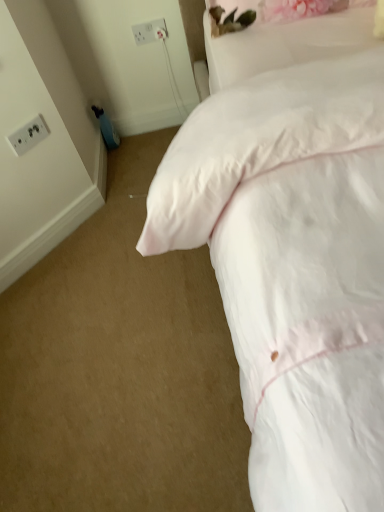
What is the approximate width of white soft bed at upper right?

white soft bed at upper right is 6.16 feet wide.

This screenshot has width=384, height=512. Identify the location of white plastic socket at upper left, the 2th electric outlet when ordered from bottom to top. (150, 31).

Is point (31, 140) positioned in front of point (370, 253)?

No, (31, 140) is behind (370, 253).

From the picture: What's the angular difference between white plastic electrical outlet at upper left, arranged as the first electric outlet when ordered from the bottom, and white soft bed at upper right's facing directions?

43.3 degrees.

In the scene shown: Considering the relative positions of white plastic electrical outlet at upper left, placed as the 2th electric outlet when sorted from right to left, and white soft bed at upper right in the image provided, is white plastic electrical outlet at upper left, placed as the 2th electric outlet when sorted from right to left, to the left or to the right of white soft bed at upper right?

From the image, it's evident that white plastic electrical outlet at upper left, placed as the 2th electric outlet when sorted from right to left, is to the left of white soft bed at upper right.

Is white plastic electrical outlet at upper left, the 2th electric outlet in the back-to-front sequence, far from white soft bed at upper right?

They are positioned close to each other.

Can we say white soft bed at upper right lies outside white plastic socket at upper left, placed as the first electric outlet when sorted from back to front?

white soft bed at upper right lies outside white plastic socket at upper left, placed as the first electric outlet when sorted from back to front,'s area.

From a real-world perspective, is white soft bed at upper right over white plastic socket at upper left, the first electric outlet positioned from the right?

Indeed, from a real-world perspective, white soft bed at upper right stands above white plastic socket at upper left, the first electric outlet positioned from the right.

Does white soft bed at upper right touch white plastic socket at upper left, positioned as the first electric outlet in top-to-bottom order?

white soft bed at upper right is not next to white plastic socket at upper left, positioned as the first electric outlet in top-to-bottom order, and they're not touching.

From their relative heights in the image, would you say white soft bed at upper right is taller or shorter than white satin pillow at upper right?

Considering their sizes, white soft bed at upper right has more height than white satin pillow at upper right.

From a real-world perspective, is white soft bed at upper right positioned over white satin pillow at upper right based on gravity?

Actually, white soft bed at upper right is physically below white satin pillow at upper right in the real world.

From the image's perspective, is white soft bed at upper right under white satin pillow at upper right?

Yes.

Looking at this image, is white soft bed at upper right closer to camera compared to white satin pillow at upper right?

Yes, it is in front of white satin pillow at upper right.

From the image's perspective, who appears lower, white plastic socket at upper left, arranged as the 2th electric outlet when viewed from the front, or white plastic electrical outlet at upper left, the 2th electric outlet in the back-to-front sequence?

From the image's view, white plastic electrical outlet at upper left, the 2th electric outlet in the back-to-front sequence, is below.

Does point (141, 40) come closer to viewer compared to point (20, 142)?

No.

Can you confirm if white plastic socket at upper left, placed as the first electric outlet when sorted from back to front, is shorter than white plastic electrical outlet at upper left, arranged as the first electric outlet when ordered from the bottom?

In fact, white plastic socket at upper left, placed as the first electric outlet when sorted from back to front, may be taller than white plastic electrical outlet at upper left, arranged as the first electric outlet when ordered from the bottom.

Is white plastic socket at upper left, the first electric outlet positioned from the right, in front of or behind white satin pillow at upper right in the image?

Clearly, white plastic socket at upper left, the first electric outlet positioned from the right, is behind white satin pillow at upper right.

Is white plastic socket at upper left, which is counted as the 2th electric outlet, starting from the left, positioned beyond the bounds of white satin pillow at upper right?

Yes, white plastic socket at upper left, which is counted as the 2th electric outlet, starting from the left, is located beyond the bounds of white satin pillow at upper right.

Between white plastic socket at upper left, positioned as the first electric outlet in top-to-bottom order, and white satin pillow at upper right, which one has larger size?

Bigger between the two is white satin pillow at upper right.

From a real-world perspective, between white plastic socket at upper left, placed as the first electric outlet when sorted from back to front, and white soft bed at upper right, who is vertically lower?

white plastic socket at upper left, placed as the first electric outlet when sorted from back to front.

From the image's perspective, does white plastic socket at upper left, positioned as the first electric outlet in top-to-bottom order, appear lower than white soft bed at upper right?

No, from the image's perspective, white plastic socket at upper left, positioned as the first electric outlet in top-to-bottom order, is not beneath white soft bed at upper right.

Considering the points (142, 30) and (297, 405), which point is behind, point (142, 30) or point (297, 405)?

The point (142, 30) is farther.

Could white soft bed at upper right be considered to be inside white plastic socket at upper left, which is counted as the 2th electric outlet, starting from the left?

No, white soft bed at upper right is not a part of white plastic socket at upper left, which is counted as the 2th electric outlet, starting from the left.

From the image's perspective, does white plastic electrical outlet at upper left, arranged as the first electric outlet when viewed from the left, appear lower than white plastic socket at upper left, the first electric outlet positioned from the right?

Yes.

From a real-world perspective, is white plastic electrical outlet at upper left, placed as the 2th electric outlet when sorted from right to left, positioned above or below white plastic socket at upper left, which is counted as the 2th electric outlet, starting from the left?

white plastic electrical outlet at upper left, placed as the 2th electric outlet when sorted from right to left, is below white plastic socket at upper left, which is counted as the 2th electric outlet, starting from the left.

You are a GUI agent. You are given a task and a screenshot of the screen. Output one action in this format:
    pyautogui.click(x=<x>, y=<y>)
    Task: Click on the electric outlet on the right of white plastic electrical outlet at upper left, arranged as the first electric outlet when viewed from the left
    The height and width of the screenshot is (512, 384).
    Given the screenshot: What is the action you would take?
    pyautogui.click(x=150, y=31)

Considering the relative sizes of white plastic electrical outlet at upper left, placed as the 2th electric outlet when sorted from right to left, and white plastic socket at upper left, the 2th electric outlet when ordered from bottom to top, in the image provided, is white plastic electrical outlet at upper left, placed as the 2th electric outlet when sorted from right to left, thinner than white plastic socket at upper left, the 2th electric outlet when ordered from bottom to top,?

Yes.

From the white soft bed at upper right, count the 2nd electric outlet to the left and point to it. Please provide its 2D coordinates.

[(28, 135)]

This screenshot has width=384, height=512. There is a white soft bed at upper right. Identify the location of the 1st electric outlet below it (from a real-world perspective). (150, 31).

Considering their positions, is white plastic electrical outlet at upper left, placed as the 2th electric outlet when sorted from right to left, positioned further to white satin pillow at upper right than white soft bed at upper right?

Among the two, white plastic electrical outlet at upper left, placed as the 2th electric outlet when sorted from right to left, is located further to white satin pillow at upper right.

Estimate the real-world distances between objects in this image. Which object is further from white plastic electrical outlet at upper left, the 2th electric outlet in the back-to-front sequence, white satin pillow at upper right or white soft bed at upper right?

white soft bed at upper right.

Looking at the image, which one is located closer to white satin pillow at upper right, white plastic socket at upper left, the 2th electric outlet when ordered from bottom to top, or white plastic electrical outlet at upper left, arranged as the first electric outlet when ordered from the bottom?

Among the two, white plastic socket at upper left, the 2th electric outlet when ordered from bottom to top, is located nearer to white satin pillow at upper right.

Looking at the image, which one is located further to white satin pillow at upper right, white soft bed at upper right or white plastic socket at upper left, positioned as the first electric outlet in top-to-bottom order?

The object further to white satin pillow at upper right is white plastic socket at upper left, positioned as the first electric outlet in top-to-bottom order.

Looking at the image, which one is located further to white satin pillow at upper right, white plastic electrical outlet at upper left, which is the second electric outlet in top-to-bottom order, or white plastic socket at upper left, the 2th electric outlet when ordered from bottom to top?

white plastic electrical outlet at upper left, which is the second electric outlet in top-to-bottom order.

Estimate the real-world distances between objects in this image. Which object is closer to white soft bed at upper right, white satin pillow at upper right or white plastic electrical outlet at upper left, placed as the first electric outlet when sorted from front to back?

white satin pillow at upper right.

From the image, which object appears to be farther from white soft bed at upper right, white plastic socket at upper left, the 2th electric outlet when ordered from bottom to top, or white plastic electrical outlet at upper left, the 2th electric outlet in the back-to-front sequence?

white plastic socket at upper left, the 2th electric outlet when ordered from bottom to top, is further to white soft bed at upper right.

Consider the image. Considering their positions, is white soft bed at upper right positioned further to white plastic socket at upper left, placed as the first electric outlet when sorted from back to front, than white satin pillow at upper right?

Among the two, white soft bed at upper right is located further to white plastic socket at upper left, placed as the first electric outlet when sorted from back to front.

This screenshot has width=384, height=512. In order to click on electric outlet between white plastic electrical outlet at upper left, placed as the first electric outlet when sorted from front to back, and white satin pillow at upper right, in the horizontal direction in this screenshot , I will do `click(150, 31)`.

Where is `pillow positioned between white soft bed at upper right and white plastic electrical outlet at upper left, the 2th electric outlet in the back-to-front sequence, from near to far`? The image size is (384, 512). pillow positioned between white soft bed at upper right and white plastic electrical outlet at upper left, the 2th electric outlet in the back-to-front sequence, from near to far is located at coordinates (285, 44).

Locate an element on the screen. The width and height of the screenshot is (384, 512). electric outlet between white soft bed at upper right and white plastic socket at upper left, placed as the first electric outlet when sorted from back to front, along the z-axis is located at coordinates (28, 135).

Where is `pillow between white soft bed at upper right and white plastic socket at upper left, the 2th electric outlet when ordered from bottom to top, in the front-back direction`? The width and height of the screenshot is (384, 512). pillow between white soft bed at upper right and white plastic socket at upper left, the 2th electric outlet when ordered from bottom to top, in the front-back direction is located at coordinates (285, 44).